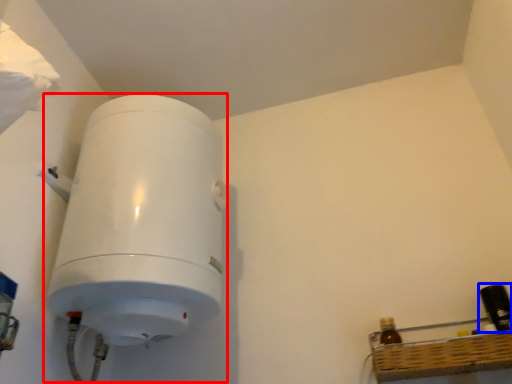
Question: Which point is further to the camera, appliance (highlighted by a red box) or bottle (highlighted by a blue box)?

Choices:
 (A) appliance
 (B) bottle

Answer: (B)